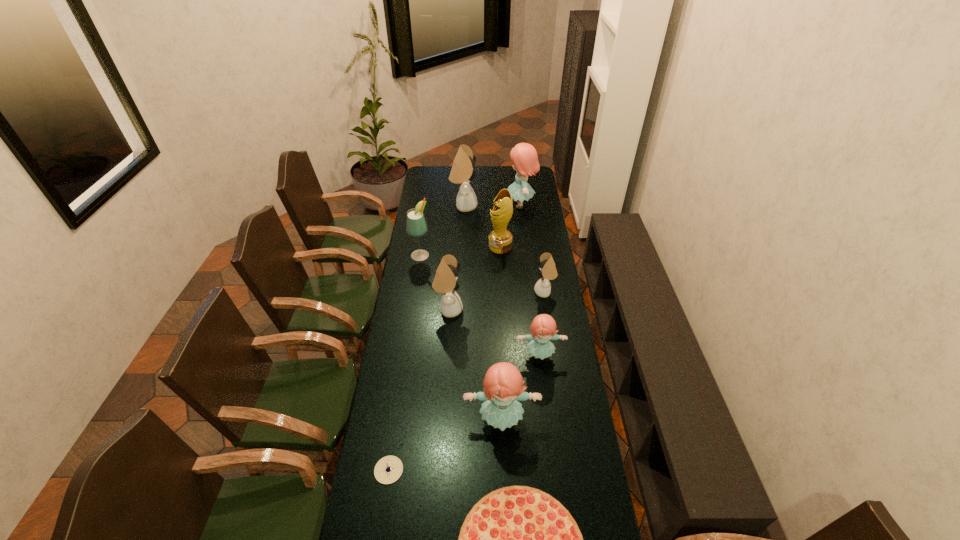
Locate an element on the screen. free space that is in between the fifth farthest doll and the award is located at coordinates (520, 301).

You are a GUI agent. You are given a task and a screenshot of the screen. Output one action in this format:
    pyautogui.click(x=<x>, y=<y>)
    Task: Click on the closest object to the second nearest object
    
    Given the screenshot: What is the action you would take?
    pyautogui.click(x=517, y=539)

Point out which object is positioned as the seventh nearest to the second biggest black doll. Please provide its 2D coordinates. Your answer should be formatted as a tuple, i.e. [(x, y)], where the tuple contains the x and y coordinates of a point satisfying the conditions above.

[(463, 165)]

Where is `doll that is the fourth closest to the second biggest black doll`? Image resolution: width=960 pixels, height=540 pixels. doll that is the fourth closest to the second biggest black doll is located at coordinates (463, 165).

Identify which doll is located as the fourth nearest to the farthest blue doll. Please provide its 2D coordinates. Your answer should be formatted as a tuple, i.e. [(x, y)], where the tuple contains the x and y coordinates of a point satisfying the conditions above.

[(543, 325)]

At what (x,y) coordinates should I click in order to perform the action: click on black doll that is the nearest to the second nearest blue doll. Please return your answer as a coordinate pair (x, y). Looking at the image, I should click on (542, 287).

Locate which black doll ranks in proximity to the pizza. Please provide its 2D coordinates. Your answer should be formatted as a tuple, i.e. [(x, y)], where the tuple contains the x and y coordinates of a point satisfying the conditions above.

[(445, 282)]

Identify the location of blue doll object that ranks as the third closest to the blue compass. (524, 156).

Choose which blue doll is the second nearest neighbor to the alcohol. Please provide its 2D coordinates. Your answer should be formatted as a tuple, i.e. [(x, y)], where the tuple contains the x and y coordinates of a point satisfying the conditions above.

[(543, 325)]